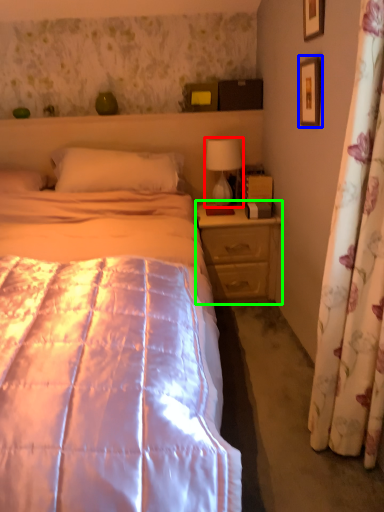
Question: Considering the real-world distances, which object is farthest from table lamp (highlighted by a red box)? picture frame (highlighted by a blue box) or nightstand (highlighted by a green box)?

Choices:
 (A) picture frame
 (B) nightstand

Answer: (A)